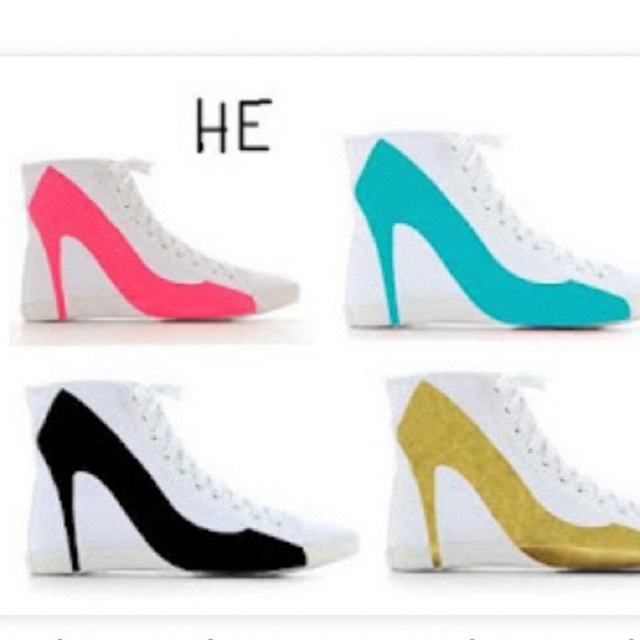
Question: Considering the relative positions of teal suede high heel at upper right and neon pink suede high-heeled shoe at upper left in the image provided, where is teal suede high heel at upper right located with respect to neon pink suede high-heeled shoe at upper left?

Choices:
 (A) left
 (B) right

Answer: (B)

Question: Does teal suede high heel at upper right appear under black matte high-heeled shoe at center?

Choices:
 (A) yes
 (B) no

Answer: (B)

Question: Considering the real-world distances, which object is closest to the gold glitter high heel at center?

Choices:
 (A) black matte high-heeled shoe at center
 (B) neon pink suede high-heeled shoe at upper left
 (C) teal suede high heel at upper right

Answer: (C)

Question: Considering the relative positions of black matte high-heeled shoe at center and gold glitter high heel at center in the image provided, where is black matte high-heeled shoe at center located with respect to gold glitter high heel at center?

Choices:
 (A) below
 (B) above

Answer: (A)

Question: Which point is closer to the camera taking this photo?

Choices:
 (A) (35, 218)
 (B) (403, 301)
 (C) (228, 528)

Answer: (C)

Question: Estimate the real-world distances between objects in this image. Which object is closer to the teal suede high heel at upper right?

Choices:
 (A) black matte high-heeled shoe at center
 (B) neon pink suede high-heeled shoe at upper left

Answer: (B)